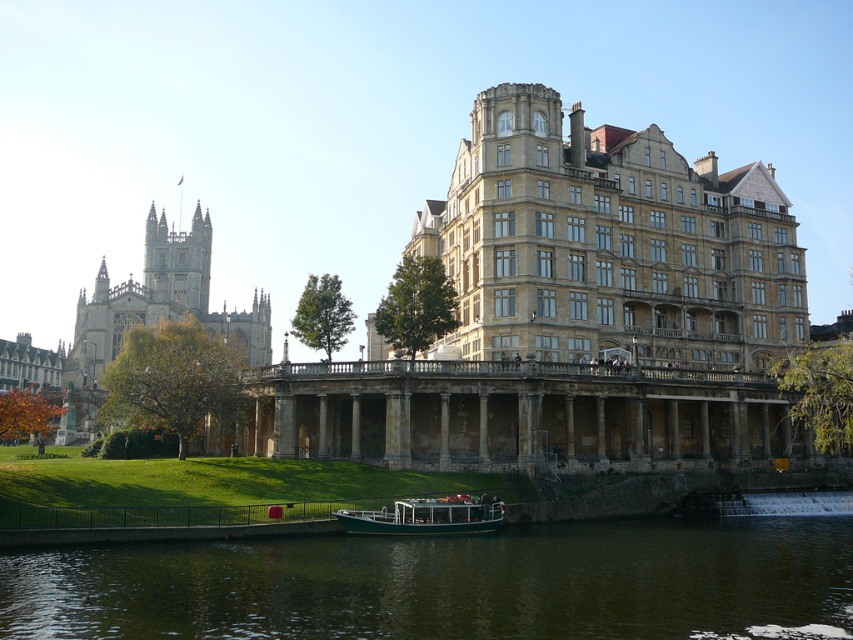
You are standing on the riverbank and want to board the green polished wood boat at lower center. Based on the scene, is the green water at lower center between you and the boat?

Yes, the green water at lower center is between you and the boat because the green water at lower center is in front of the green polished wood boat at lower center, meaning the water is closer to your position on the riverbank than the boat itself.

You are standing at the point with coordinates point (347,520) and want to walk towards the point with coordinates point (496,540). Which direction should you move relative to your current position?

You should move backward because point (496,540) is behind point (347,520) relative to your current position.

You are a photographer standing at the edge of the river and want to capture both the green water at lower center and the green polished wood boat at lower center in your shot. Which object will appear closer to the top of your photo?

The green water at lower center will appear closer to the top of the photo because it is taller than the green polished wood boat at lower center.